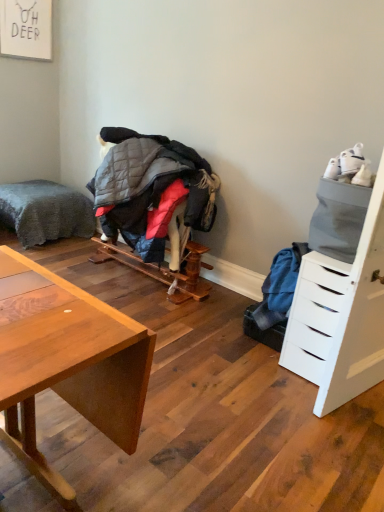
Image resolution: width=384 pixels, height=512 pixels. Identify the location of vacant space in front of white matte drawer at right. (324, 418).